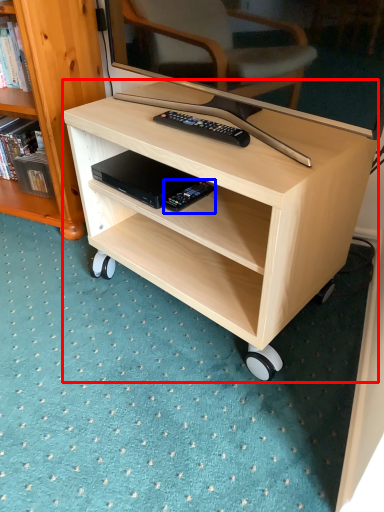
Question: Which point is further to the camera, desk (highlighted by a red box) or equipment (highlighted by a blue box)?

Choices:
 (A) desk
 (B) equipment

Answer: (B)